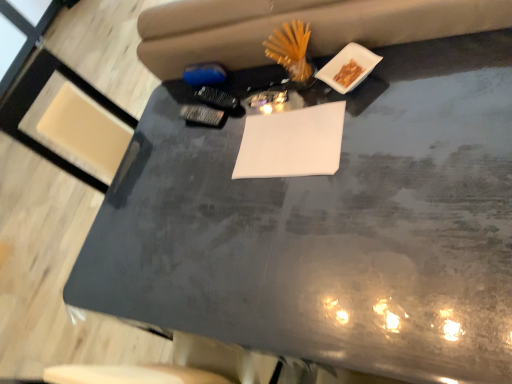
This screenshot has width=512, height=384. Identify the location of vacant space underneath white paper at center (from a real-world perspective). (293, 144).